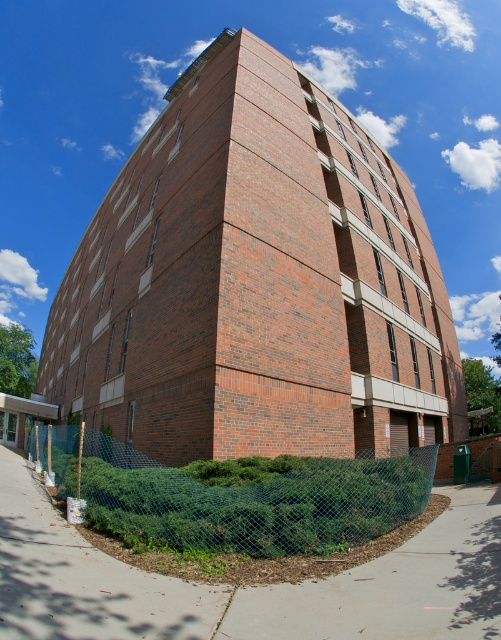
You are a delivery person trying to park your 2.5 meter wide delivery truck in the area shown in the image. You see the gray concrete pavement at lower center and the blue mesh fence at lower left. Which area can accommodate your truck based on their widths?

The gray concrete pavement at lower center has a width less than the blue mesh fence at lower left. Since the truck is 2.5 meters wide, you need to check which area is wider. The blue mesh fence at lower left is wider, so the truck can fit there if the width is at least 2.5 meters. However, without exact measurements, it is uncertain. But according to the description, the pavement is narrower than the fence, so the blue mesh fence at lower left area is the better option.

You are standing in front of the building and want to take a photo that includes both the point at location (478, 600) and the point at (280, 525). Given that you need to ensure both points are in focus, which point should you focus on to maximize the depth of field?

You should focus on point (280, 525) because it is farther from the camera than point (478, 600). By focusing on the farther point, the depth of field will extend backward to include the closer point as well, ensuring both are in focus.

You are a delivery person standing at the entrance of the building. You need to place a large box on the gray concrete pavement at lower center. However, there is a blue mesh fence at lower left nearby. Which object is shorter, allowing the box to be placed on it?

The gray concrete pavement at lower center is shorter than the blue mesh fence at lower left, so the box can be placed on the gray concrete pavement at lower center since it is shorter.